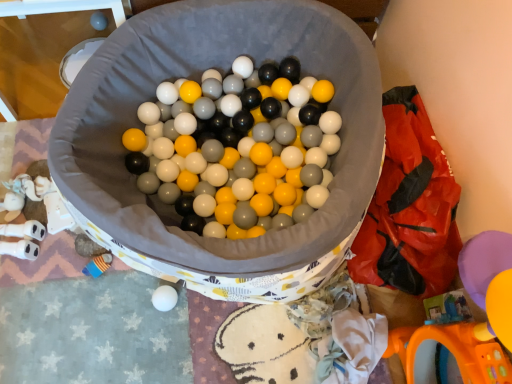
Question: Relative to rubberized plastic bag at right, is matte gray ball at upper left in front or behind?

Choices:
 (A) behind
 (B) front

Answer: (A)

Question: In terms of height, does matte gray ball at upper left look taller or shorter compared to rubberized plastic bag at right?

Choices:
 (A) short
 (B) tall

Answer: (A)

Question: From the image's perspective, relative to rubberized plastic bag at right, is matte gray ball at upper left above or below?

Choices:
 (A) below
 (B) above

Answer: (B)

Question: From a real-world perspective, is rubberized plastic bag at right above or below matte gray ball at upper left?

Choices:
 (A) below
 (B) above

Answer: (B)

Question: Relative to matte gray ball at upper left, is rubberized plastic bag at right in front or behind?

Choices:
 (A) front
 (B) behind

Answer: (A)

Question: Looking at the image, does rubberized plastic bag at right seem bigger or smaller compared to matte gray ball at upper left?

Choices:
 (A) big
 (B) small

Answer: (A)

Question: Based on their positions, is rubberized plastic bag at right located to the left or right of matte gray ball at upper left?

Choices:
 (A) left
 (B) right

Answer: (B)